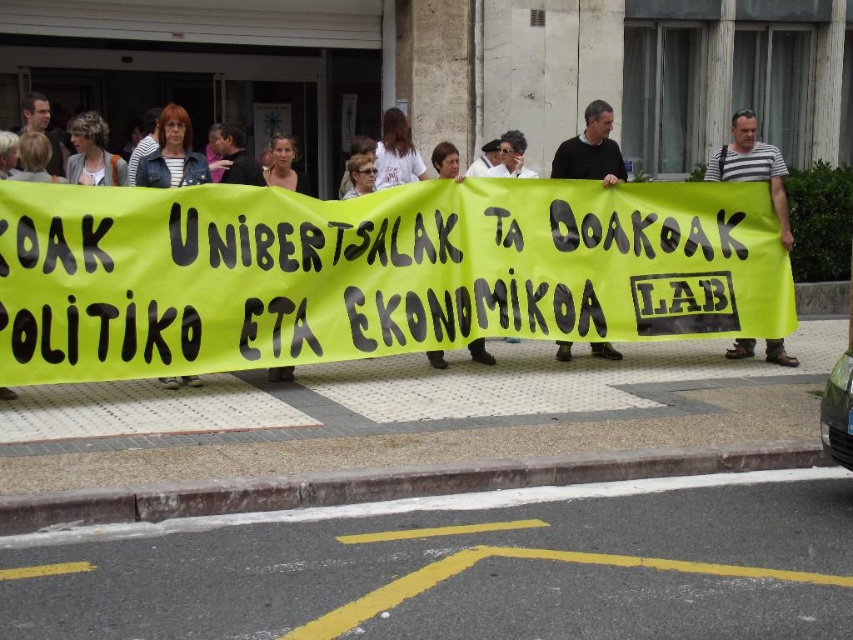
Question: Does striped fabric shirt at center have a smaller size compared to black sweater at center?

Choices:
 (A) no
 (B) yes

Answer: (A)

Question: Is striped fabric shirt at center closer to camera compared to striped fabric jacket at center?

Choices:
 (A) no
 (B) yes

Answer: (A)

Question: From the image, what is the correct spatial relationship of yellow fabric banner at center in relation to black sweater at center?

Choices:
 (A) right
 (B) left

Answer: (A)

Question: Among these objects, which one is nearest to the camera?

Choices:
 (A) yellow fabric banner at center
 (B) striped fabric jacket at center

Answer: (B)

Question: Which point appears closest to the camera in this image?

Choices:
 (A) (311, 227)
 (B) (601, 154)
 (C) (738, 113)

Answer: (A)

Question: Which of the following is the farthest from the observer?

Choices:
 (A) (619, 353)
 (B) (154, 154)

Answer: (A)